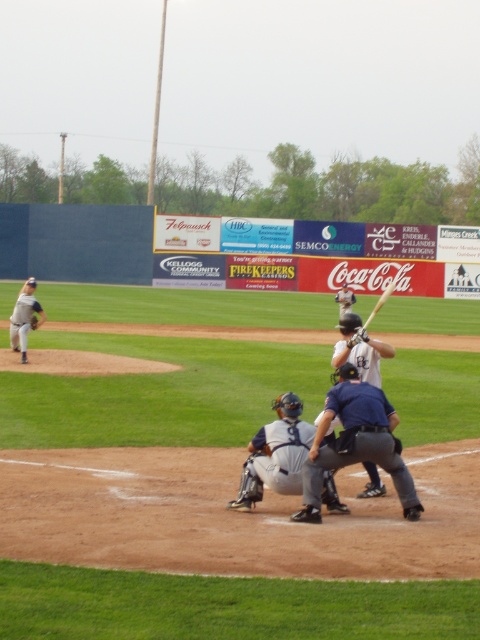
Question: Is dark blue uniform at center to the right of matte white helmet at center from the viewer's perspective?

Choices:
 (A) no
 (B) yes

Answer: (A)

Question: Is gray uniformed pitcher at left positioned at the back of brown leather glove at lower center?

Choices:
 (A) yes
 (B) no

Answer: (A)

Question: Which point appears closest to the camera in this image?

Choices:
 (A) (391, 284)
 (B) (343, 380)
 (C) (35, 324)
 (D) (360, 337)

Answer: (B)

Question: Considering the relative positions of gray uniformed pitcher at left and brown leather glove at left in the image provided, where is gray uniformed pitcher at left located with respect to brown leather glove at left?

Choices:
 (A) right
 (B) left

Answer: (B)

Question: Which point is farther from the camera taking this photo?

Choices:
 (A) (349, 342)
 (B) (376, 492)
 (C) (326, 419)
 (D) (386, 285)

Answer: (D)

Question: Among these points, which one is farthest from the camera?

Choices:
 (A) (328, 492)
 (B) (31, 317)
 (C) (340, 326)
 (D) (379, 301)

Answer: (B)